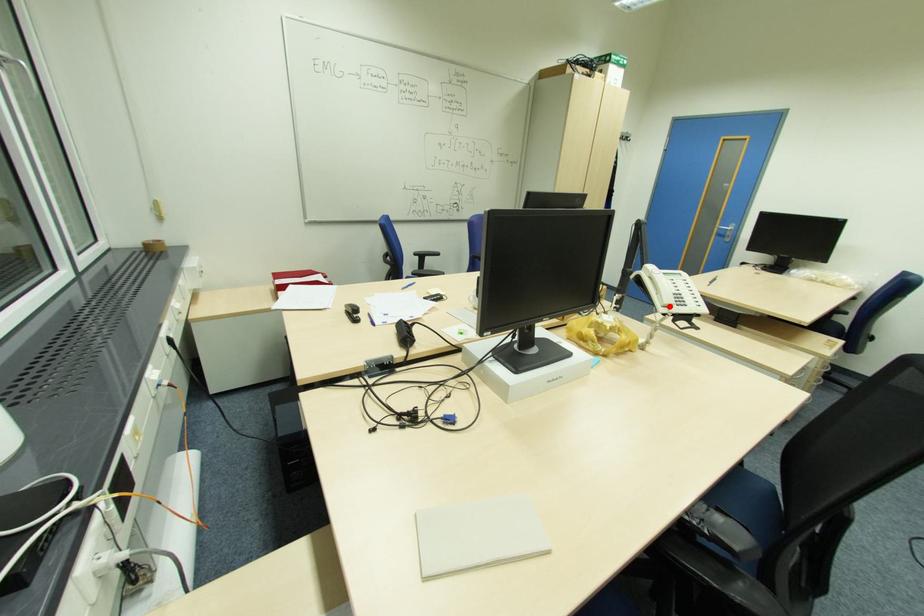
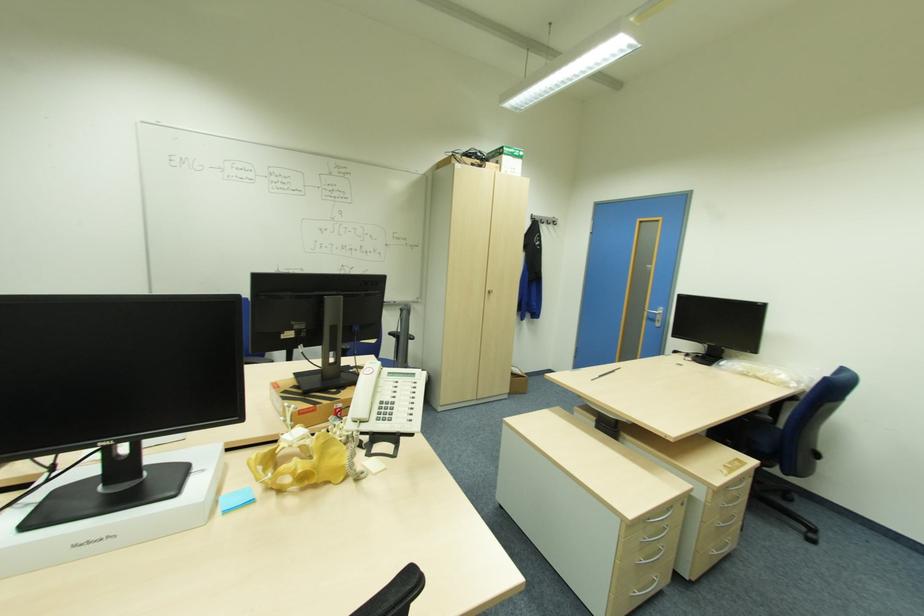
In the second image, find the point that corresponds to the highlighted location in the first image.

(359, 422)